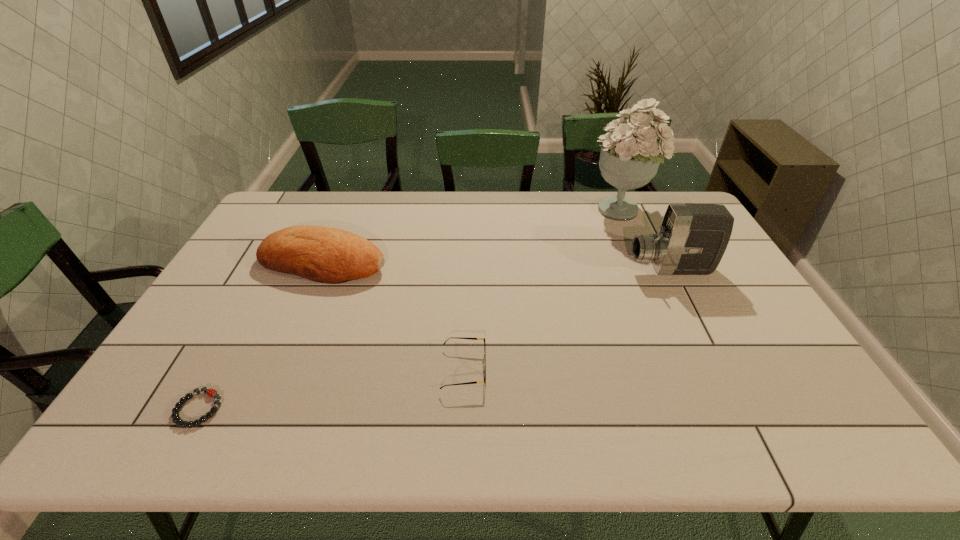
Where is `object that is the third closest one to the shortest object`? This screenshot has width=960, height=540. object that is the third closest one to the shortest object is located at coordinates (692, 239).

What are the coordinates of `free space that satisfies the following two spatial constraints: 1. on the back side of the farthest object; 2. on the left side of the bread` in the screenshot? It's located at (347, 209).